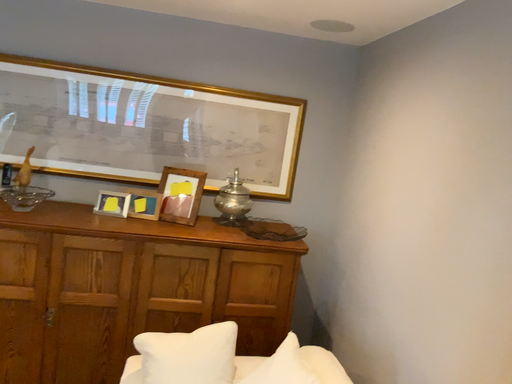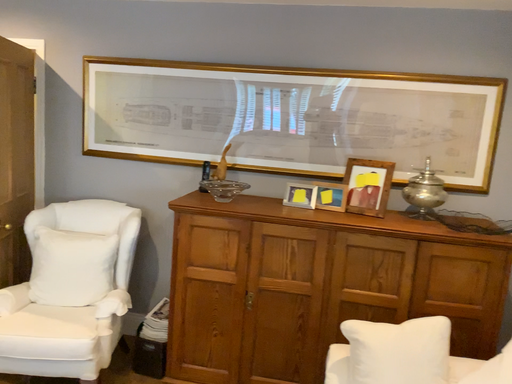
Question: How did the camera likely rotate when shooting the video?

Choices:
 (A) rotated left
 (B) rotated right

Answer: (A)